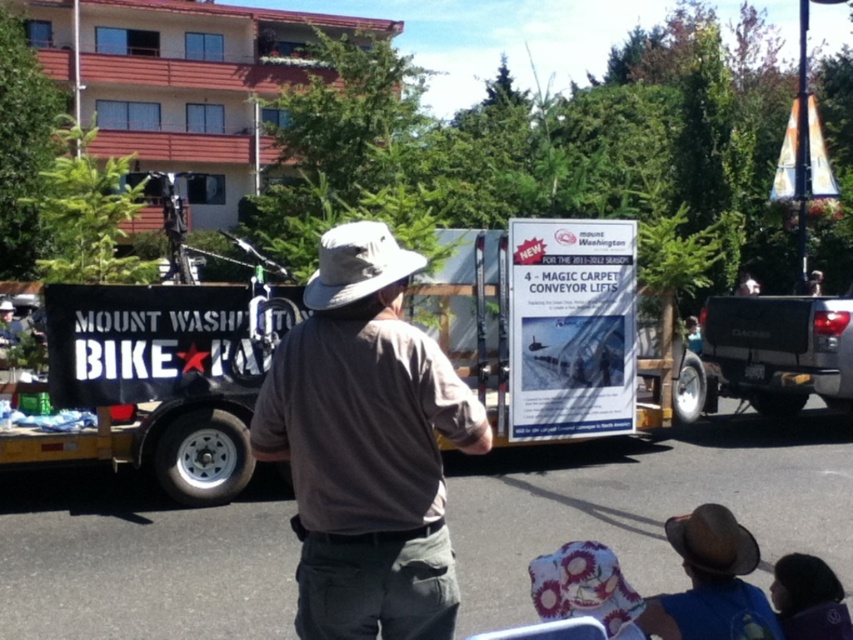
Does brown cotton shirt at center have a smaller size compared to black matte trailer at center?

Yes, brown cotton shirt at center is smaller than black matte trailer at center.

Measure the distance between point [399,570] and camera.

Point [399,570] and camera are 8.44 feet apart.

The image size is (853, 640). Identify the location of brown cotton shirt at center. (366, 445).

Between point (425, 304) and point (354, 236), which one is positioned behind?

Positioned behind is point (425, 304).

Looking at this image, is black matte trailer at center below light gray fabric cowboy hat at center?

Yes.

Is point (231, 360) closer to camera compared to point (334, 296)?

No.

Locate an element on the screen. black matte trailer at center is located at coordinates (152, 385).

Can you confirm if matte black truck at right is positioned above brown felt cowboy hat at lower center?

Yes.

Is matte black truck at right to the right of brown felt cowboy hat at lower center from the viewer's perspective?

Correct, you'll find matte black truck at right to the right of brown felt cowboy hat at lower center.

This screenshot has width=853, height=640. What are the coordinates of `matte black truck at right` in the screenshot? It's located at (780, 349).